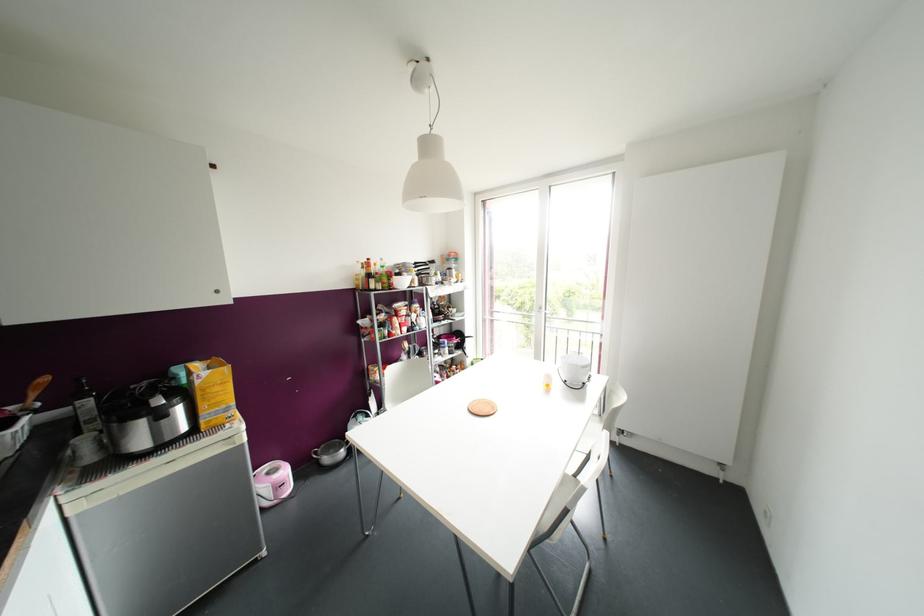
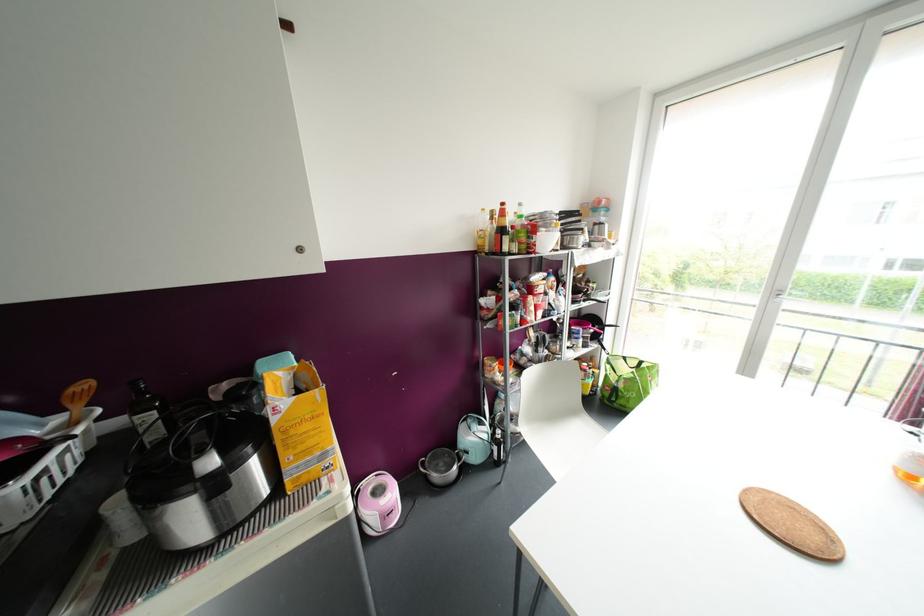
In a continuous first-person perspective shot, in which direction is the camera moving?

The movement direction of the cameraman is left, forward.